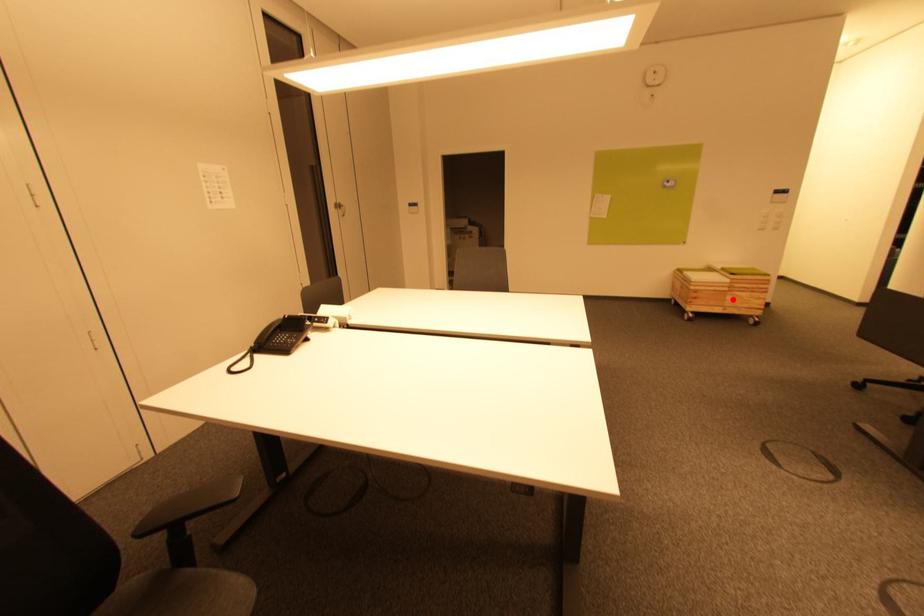
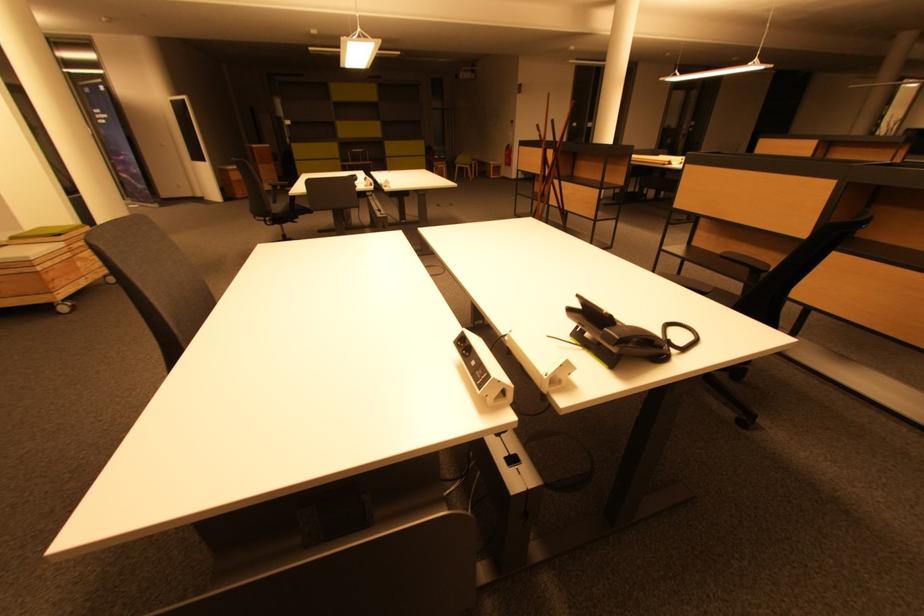
Question: A red point is marked in image1. In image2, is the corresponding 3D point closer to the camera or farther? Reply with the corresponding letter.

Choices:
 (A) The corresponding 3D point is closer.
 (B) The corresponding 3D point is farther.

Answer: (B)